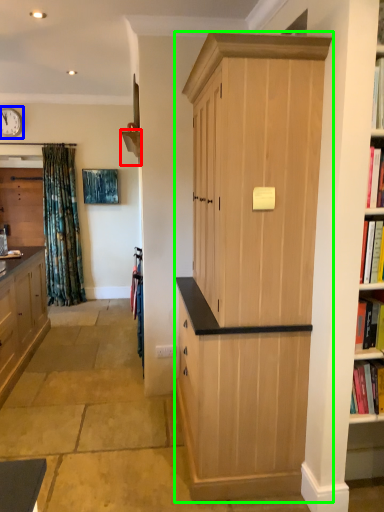
Question: Considering the real-world distances, which object is closest to shelf (highlighted by a red box)? clock (highlighted by a blue box) or cabinetry (highlighted by a green box).

Choices:
 (A) clock
 (B) cabinetry

Answer: (B)